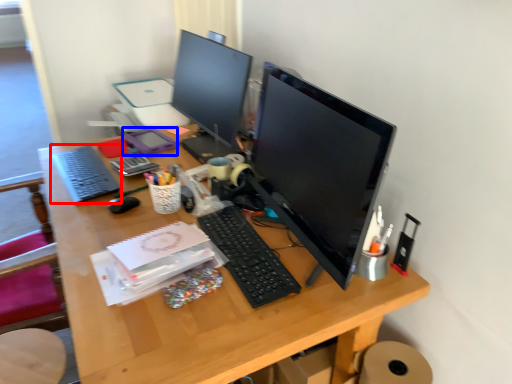
Question: Which object is closer to the camera taking this photo, computer keyboard (highlighted by a red box) or stationery (highlighted by a blue box)?

Choices:
 (A) computer keyboard
 (B) stationery

Answer: (A)